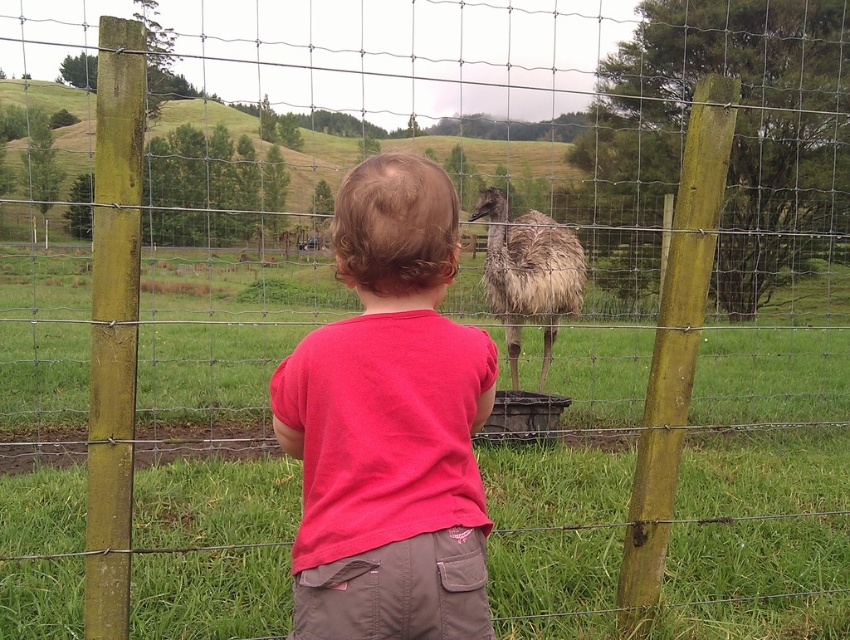
Question: Is pink cotton shirt at center bigger than brown feathered ostrich at center?

Choices:
 (A) no
 (B) yes

Answer: (A)

Question: Which of the following is the closest to the observer?

Choices:
 (A) (558, 257)
 (B) (421, 372)

Answer: (B)

Question: Is pink cotton shirt at center thinner than brown feathered ostrich at center?

Choices:
 (A) yes
 (B) no

Answer: (A)

Question: Does pink cotton shirt at center appear on the right side of brown feathered ostrich at center?

Choices:
 (A) no
 (B) yes

Answer: (A)

Question: Among these objects, which one is farthest from the camera?

Choices:
 (A) brown feathered ostrich at center
 (B) pink cotton shirt at center

Answer: (A)